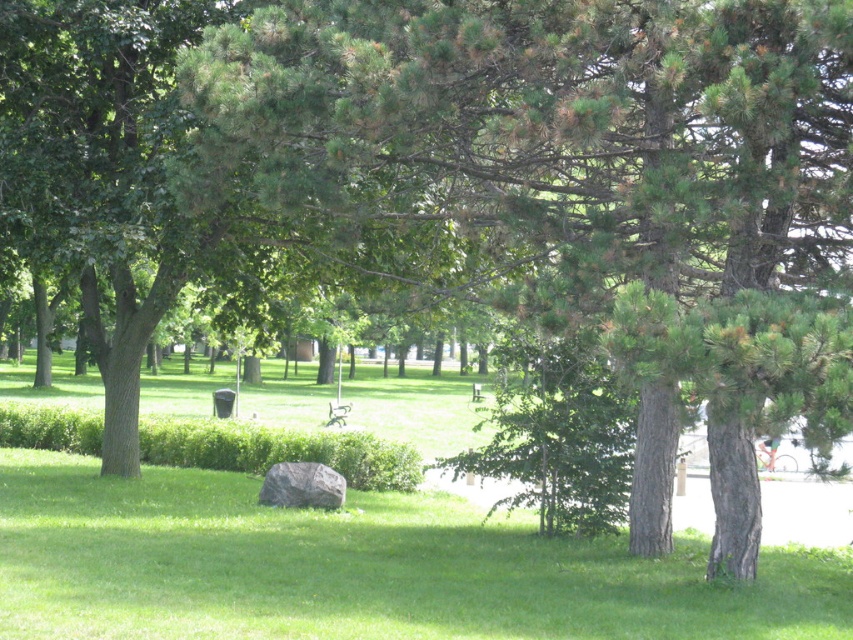
You are a visitor in the park and want to sit on the wooden park bench at center. However, you notice the gray rough boulder at center is blocking your path. Can you walk around the boulder to reach the bench?

The gray rough boulder at center is in front of the wooden park bench at center, so you can walk around the boulder to reach the bench as long as there is space around it.

You are standing in the park and want to take a photo of the green textured tree at center. The camera you have can focus on objects up to 15 meters away. Will the tree be in focus?

The green textured tree at center is 14.76 meters away from the viewer, which is within the camera focus range of up to 15 meters. Therefore, the tree will be in focus.

You are a park visitor trying to find a shaded spot under the green textured tree at center and the gray rough boulder at center. Which object provides more shade for you to sit under?

The green textured tree at center is located below the gray rough boulder at center, so the gray rough boulder at center is higher and likely casts a larger shadow, providing more shade. You should sit under the gray rough boulder at center.